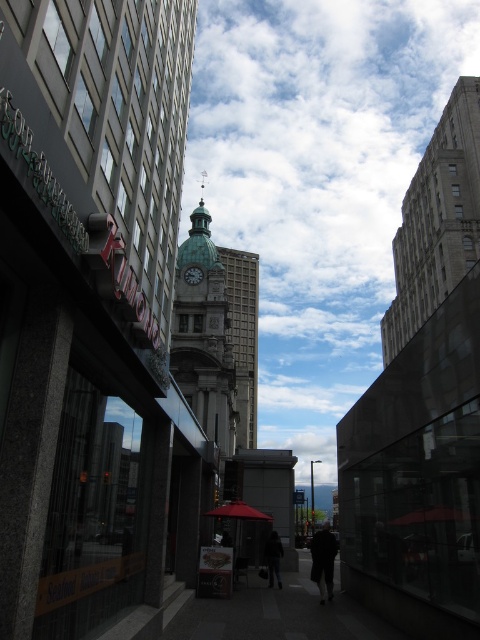
You are standing at the center of the image and want to locate the gray stone building at upper right. According to the coordinate system where the bottom left corner is the origin, can you determine its position?

The gray stone building at upper right is located at coordinate point (x=436, y=220).

You are a delivery person standing at the entrance of the modern building with the Kumono sign. You need to place a package on the dark fabric coat at center and the silver metallic clock at center. Which object should you place the package on if you want it to be more visible from the street?

The dark fabric coat at center is much taller than the silver metallic clock at center, so placing the package on the dark fabric coat at center would make it more visible from the street.